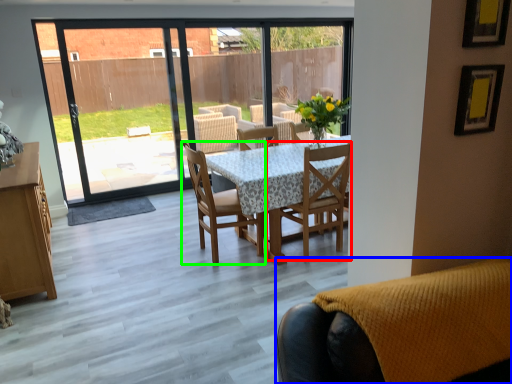
Question: Which is nearer to the chair (highlighted by a red box)? chair (highlighted by a blue box) or chair (highlighted by a green box).

Choices:
 (A) chair
 (B) chair

Answer: (B)